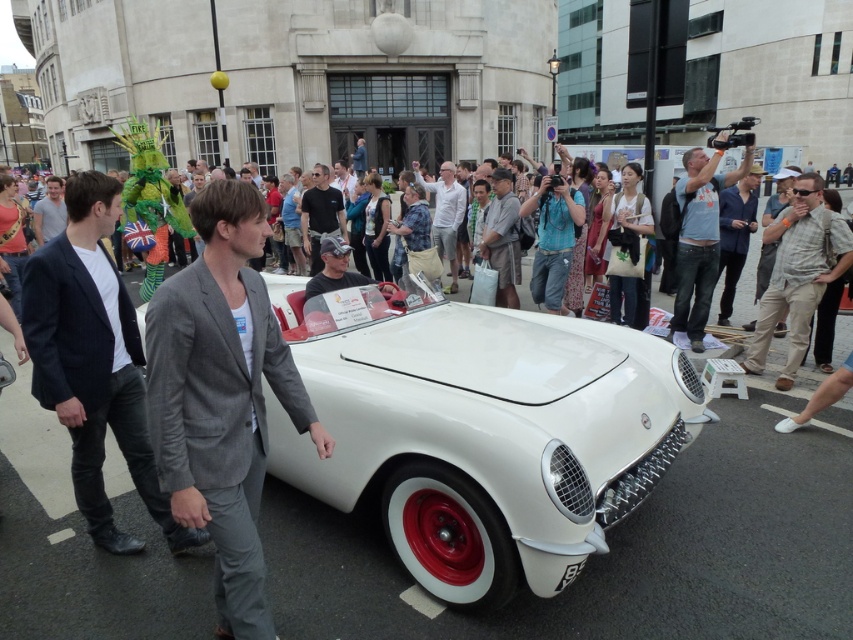
Which is below, dark blue suit at center or denim shirt at upper right?

dark blue suit at center is below.

Is dark blue suit at center above denim shirt at upper right?

Actually, dark blue suit at center is below denim shirt at upper right.

Measure the distance between point (56,385) and camera.

9.50 feet

What are the coordinates of `dark blue suit at center` in the screenshot? It's located at (93, 362).

Is gray wool blazer at center thinner than dark blue suit at center?

Yes, gray wool blazer at center is thinner than dark blue suit at center.

Is point (254, 419) closer to viewer compared to point (88, 337)?

Yes, point (254, 419) is in front of point (88, 337).

Where is `gray wool blazer at center`? gray wool blazer at center is located at coordinates (222, 396).

Does white matte car at center appear on the left side of gray suit jacket at left?

In fact, white matte car at center is to the right of gray suit jacket at left.

Is white matte car at center above gray suit jacket at left?

No.

Which is behind, point (511, 380) or point (53, 212)?

The point (53, 212) is more distant.

The height and width of the screenshot is (640, 853). Identify the location of white matte car at center. (480, 429).